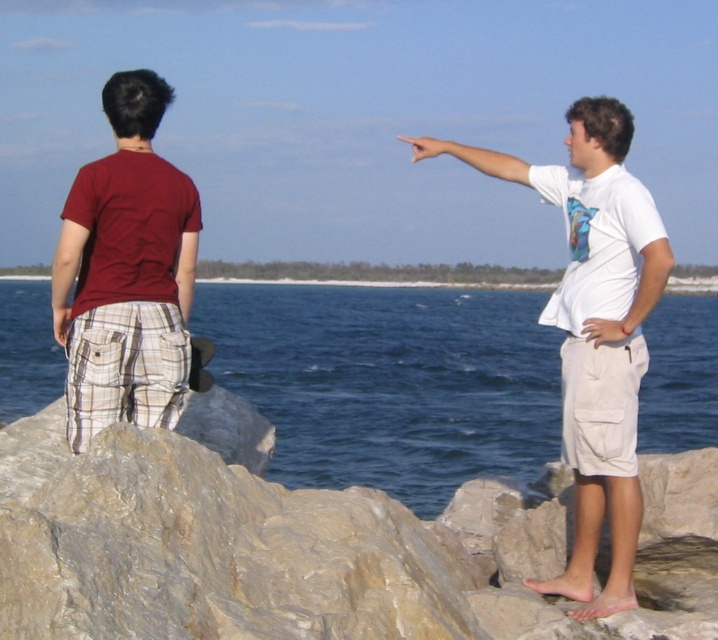
You are a photographer positioned at the origin point of the image. You need to capture a photo of the white cotton shirt at right. What are the coordinates you should aim your camera at?

The coordinates to aim the camera at are 0.522 on the x axis and 0.829 on the y axis, as the white cotton shirt at right is located at point (595, 333).